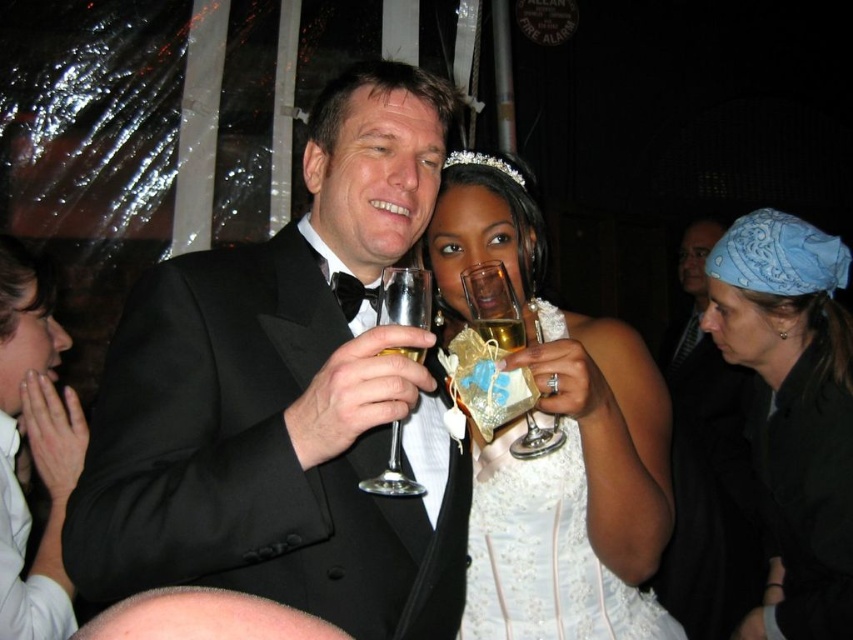
Question: Which object is positioned farthest from the clear glass wine glass at center?

Choices:
 (A) translucent glass wine glass at center
 (B) blue bandana at upper right

Answer: (B)

Question: Which of the following is the farthest from the observer?

Choices:
 (A) (392, 422)
 (B) (518, 628)
 (C) (334, 476)
 (D) (486, 320)

Answer: (B)

Question: Is black satin tuxedo at center positioned behind gold metallic champagne glass at center?

Choices:
 (A) yes
 (B) no

Answer: (B)

Question: Which object appears farthest from the camera in this image?

Choices:
 (A) black satin tuxedo at center
 (B) gold metallic champagne glass at center
 (C) clear glass wine glass at center

Answer: (B)

Question: Is dark gray suit at right positioned behind gold metallic champagne glass at center?

Choices:
 (A) yes
 (B) no

Answer: (A)

Question: Considering the relative positions of black satin tuxedo at center and translucent glass wine glass at center in the image provided, where is black satin tuxedo at center located with respect to translucent glass wine glass at center?

Choices:
 (A) left
 (B) right

Answer: (A)